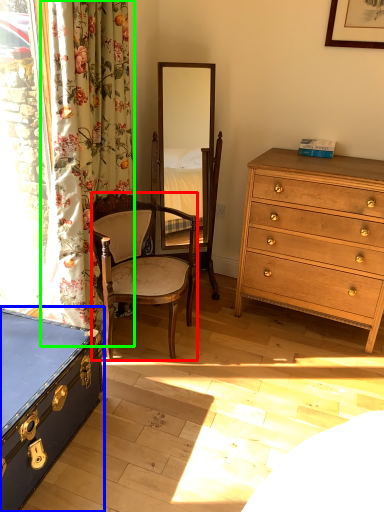
Question: Considering the real-world distances, which object is closest to chair (highlighted by a red box)? box (highlighted by a blue box) or curtain (highlighted by a green box).

Choices:
 (A) box
 (B) curtain

Answer: (B)